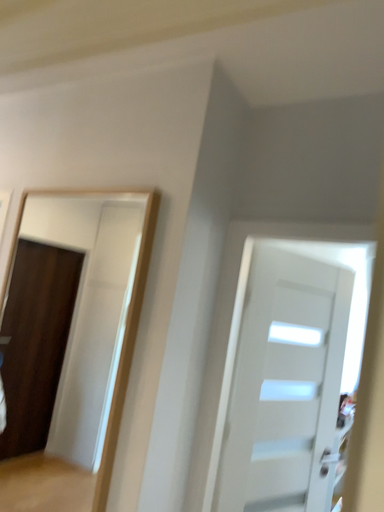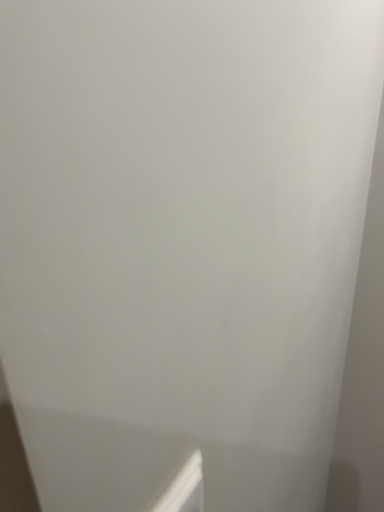
Question: How did the camera likely rotate when shooting the video?

Choices:
 (A) rotated downward
 (B) rotated upward

Answer: (A)